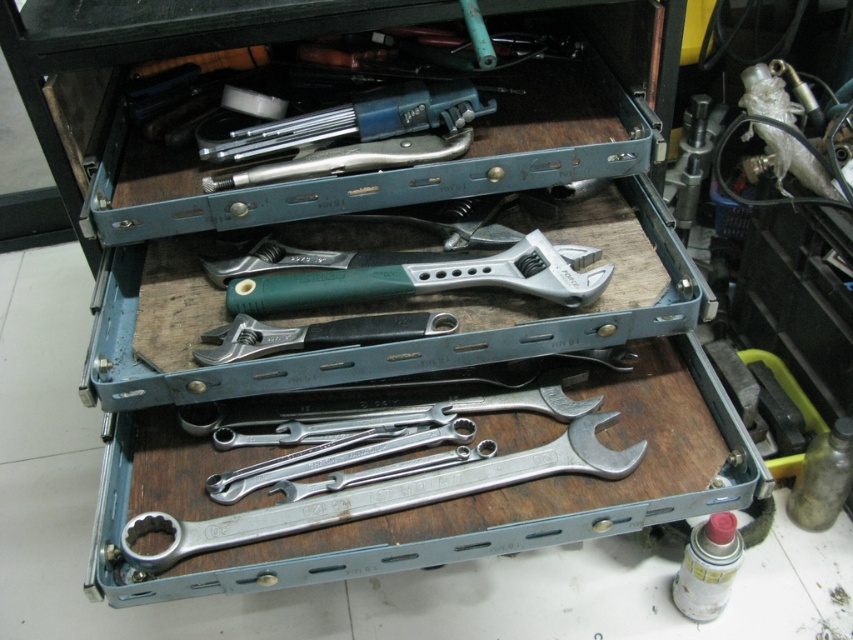
You need to choose between the silver metallic wrench at center and the black rubberized wrench at center for a tight space task. Which wrench should you pick and why?

You should pick the black rubberized wrench at center because it is smaller than the silver metallic wrench at center, making it more suitable for tight spaces.